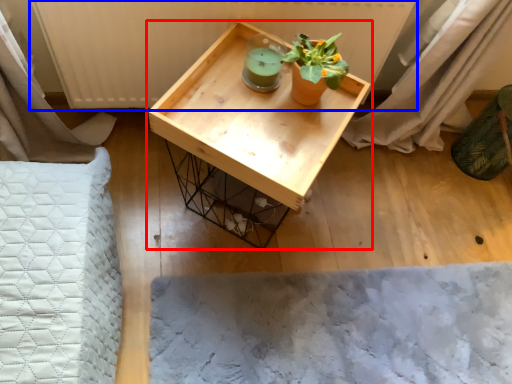
Question: Which of the following is the farthest to the observer, table (highlighted by a red box) or radiator (highlighted by a blue box)?

Choices:
 (A) table
 (B) radiator

Answer: (B)